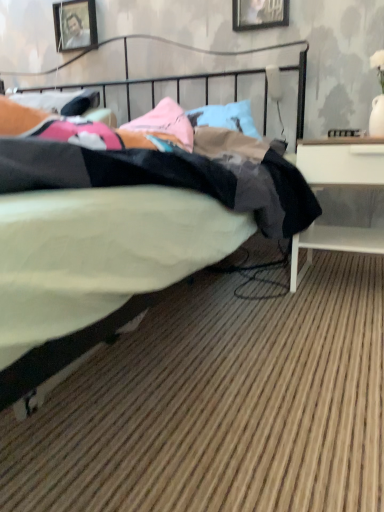
Question: From a real-world perspective, is wooden picture frame at upper left, which is the 1th picture frame in back-to-front order, above or below black fabric bed at center?

Choices:
 (A) above
 (B) below

Answer: (A)

Question: Is wooden picture frame at upper left, which is counted as the second picture frame, starting from the front, taller or shorter than black fabric bed at center?

Choices:
 (A) tall
 (B) short

Answer: (B)

Question: Estimate the real-world distances between objects in this image. Which object is farther from the black fabric bed at center?

Choices:
 (A) white matte desk at right
 (B) wooden picture frame at upper center, the 2th picture frame positioned from the left
 (C) wooden picture frame at upper left, which is the 1th picture frame in back-to-front order

Answer: (C)

Question: Estimate the real-world distances between objects in this image. Which object is farther from the black fabric bed at center?

Choices:
 (A) wooden picture frame at upper left, which is counted as the second picture frame, starting from the front
 (B) wooden picture frame at upper center, which is counted as the first picture frame, starting from the front
 (C) white matte desk at right

Answer: (A)